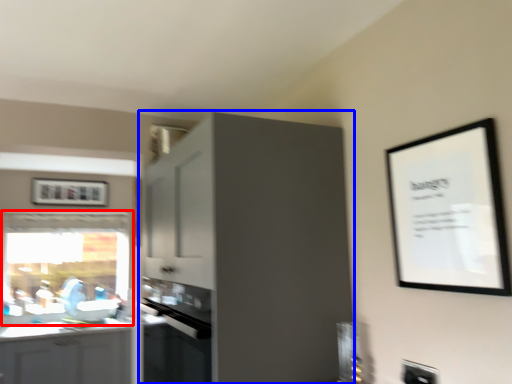
Question: Among these objects, which one is farthest to the camera, window (highlighted by a red box) or cabinetry (highlighted by a blue box)?

Choices:
 (A) window
 (B) cabinetry

Answer: (A)